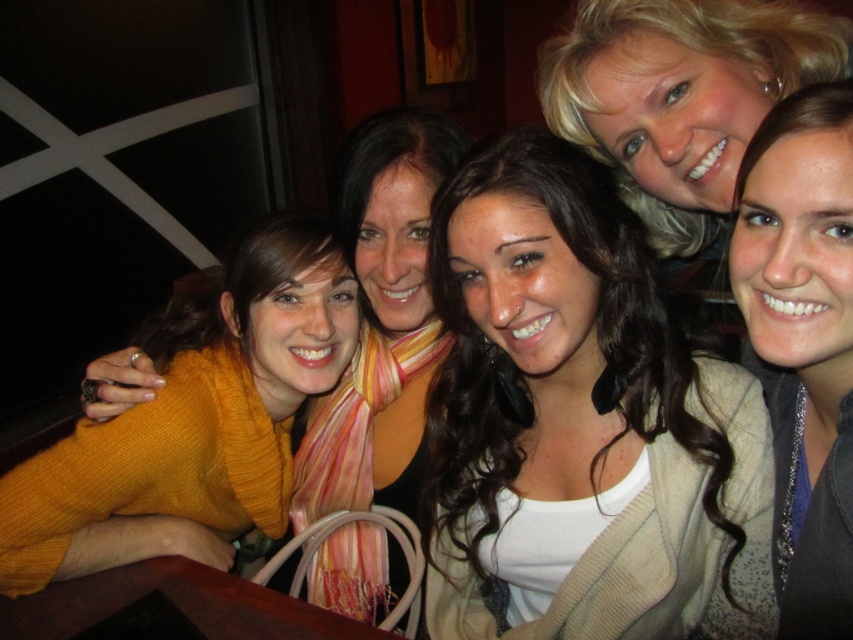
Question: Is white matte shirt at center below matte gray sweater at upper right?

Choices:
 (A) yes
 (B) no

Answer: (A)

Question: Does white matte shirt at center have a smaller size compared to matte gray sweater at upper right?

Choices:
 (A) no
 (B) yes

Answer: (A)

Question: Estimate the real-world distances between objects in this image. Which object is closer to the matte yellow sweater at left?

Choices:
 (A) white matte shirt at center
 (B) matte gray sweater at upper right

Answer: (A)

Question: Which point is closer to the camera?

Choices:
 (A) matte gray sweater at upper right
 (B) white matte shirt at center
 (C) matte yellow sweater at left

Answer: (A)

Question: Among these objects, which one is farthest from the camera?

Choices:
 (A) matte gray sweater at upper right
 (B) white matte shirt at center
 (C) matte yellow sweater at left

Answer: (C)

Question: Can you confirm if white matte shirt at center is wider than matte gray sweater at upper right?

Choices:
 (A) no
 (B) yes

Answer: (B)